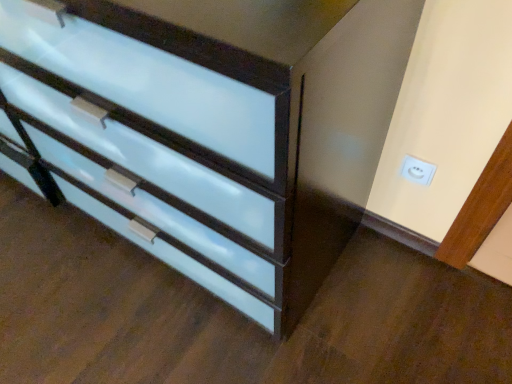
Find the location of a particular element. matte white chest of drawers at lower left is located at coordinates (157, 141).

Measure the distance between point (258,248) and camera.

Point (258,248) is 30.31 inches away from camera.

The image size is (512, 384). What do you see at coordinates (157, 141) in the screenshot? I see `matte white chest of drawers at lower left` at bounding box center [157, 141].

Consider the image. What is the approximate height of matte white chest of drawers at lower left?

The height of matte white chest of drawers at lower left is 33.77 inches.

The image size is (512, 384). What do you see at coordinates (417, 170) in the screenshot?
I see `white plastic electric outlet at upper right` at bounding box center [417, 170].

Measure the distance between white plastic electric outlet at upper right and camera.

white plastic electric outlet at upper right is 1.04 meters away from camera.

Where is `white plastic electric outlet at upper right`? The image size is (512, 384). white plastic electric outlet at upper right is located at coordinates (417, 170).

Locate an element on the screen. matte white chest of drawers at lower left is located at coordinates (157, 141).

Is white plastic electric outlet at upper right to the left of matte white chest of drawers at lower left from the viewer's perspective?

No, white plastic electric outlet at upper right is not to the left of matte white chest of drawers at lower left.

Is white plastic electric outlet at upper right closer to camera compared to matte white chest of drawers at lower left?

No, the depth of white plastic electric outlet at upper right is greater than that of matte white chest of drawers at lower left.

Is point (418, 159) closer or farther from the camera than point (69, 84)?

Point (418, 159).

From the image's perspective, is white plastic electric outlet at upper right under matte white chest of drawers at lower left?

Yes.

From a real-world perspective, who is located higher, white plastic electric outlet at upper right or matte white chest of drawers at lower left?

matte white chest of drawers at lower left is physically above.

Is white plastic electric outlet at upper right thinner than matte white chest of drawers at lower left?

Indeed, white plastic electric outlet at upper right has a lesser width compared to matte white chest of drawers at lower left.

Considering the relative sizes of white plastic electric outlet at upper right and matte white chest of drawers at lower left in the image provided, is white plastic electric outlet at upper right taller than matte white chest of drawers at lower left?

No, white plastic electric outlet at upper right is not taller than matte white chest of drawers at lower left.

Who is smaller, white plastic electric outlet at upper right or matte white chest of drawers at lower left?

white plastic electric outlet at upper right.

Is white plastic electric outlet at upper right inside the boundaries of matte white chest of drawers at lower left, or outside?

white plastic electric outlet at upper right lies outside matte white chest of drawers at lower left.

Is white plastic electric outlet at upper right positioned far away from matte white chest of drawers at lower left?

No, there isn't a large distance between white plastic electric outlet at upper right and matte white chest of drawers at lower left.

Is white plastic electric outlet at upper right positioned with its back to matte white chest of drawers at lower left?

No, matte white chest of drawers at lower left is not at the back of white plastic electric outlet at upper right.

Measure the distance between white plastic electric outlet at upper right and matte white chest of drawers at lower left.

white plastic electric outlet at upper right and matte white chest of drawers at lower left are 27.35 inches apart.

Identify the location of electric outlet beneath the matte white chest of drawers at lower left (from a real-world perspective). (417, 170).

Between matte white chest of drawers at lower left and white plastic electric outlet at upper right, which one appears on the right side from the viewer's perspective?

white plastic electric outlet at upper right is more to the right.

Between matte white chest of drawers at lower left and white plastic electric outlet at upper right, which one is positioned in front?

matte white chest of drawers at lower left is in front.

Considering the positions of points (76, 87) and (411, 156), is point (76, 87) closer to camera compared to point (411, 156)?

Yes, point (76, 87) is in front of point (411, 156).

From the image's perspective, is matte white chest of drawers at lower left below white plastic electric outlet at upper right?

Actually, matte white chest of drawers at lower left appears above white plastic electric outlet at upper right in the image.

From a real-world perspective, between matte white chest of drawers at lower left and white plastic electric outlet at upper right, who is vertically higher?

matte white chest of drawers at lower left.

From the picture: Is matte white chest of drawers at lower left wider than white plastic electric outlet at upper right?

Indeed, matte white chest of drawers at lower left has a greater width compared to white plastic electric outlet at upper right.

Can you confirm if matte white chest of drawers at lower left is taller than white plastic electric outlet at upper right?

Correct, matte white chest of drawers at lower left is much taller as white plastic electric outlet at upper right.

From the picture: Considering the sizes of objects matte white chest of drawers at lower left and white plastic electric outlet at upper right in the image provided, who is bigger, matte white chest of drawers at lower left or white plastic electric outlet at upper right?

With larger size is matte white chest of drawers at lower left.

Is white plastic electric outlet at upper right located within matte white chest of drawers at lower left?

No, white plastic electric outlet at upper right is not inside matte white chest of drawers at lower left.

Would you consider matte white chest of drawers at lower left to be distant from white plastic electric outlet at upper right?

matte white chest of drawers at lower left is actually quite close to white plastic electric outlet at upper right.

Could you tell me if matte white chest of drawers at lower left is turned towards white plastic electric outlet at upper right?

No, matte white chest of drawers at lower left is not aimed at white plastic electric outlet at upper right.

Image resolution: width=512 pixels, height=384 pixels. I want to click on chest of drawers lying on the left of white plastic electric outlet at upper right, so click(157, 141).

Identify the location of electric outlet lying below the matte white chest of drawers at lower left (from the image's perspective). (417, 170).

You are a GUI agent. You are given a task and a screenshot of the screen. Output one action in this format:
    pyautogui.click(x=<x>, y=<y>)
    Task: Click on the chest of drawers above the white plastic electric outlet at upper right (from the image's perspective)
    
    Given the screenshot: What is the action you would take?
    pyautogui.click(x=157, y=141)